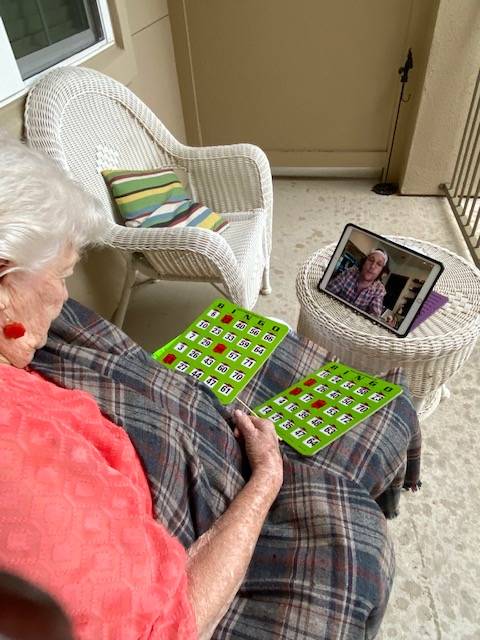
Find the location of `plaid blanket`. plaid blanket is located at coordinates (152, 413).